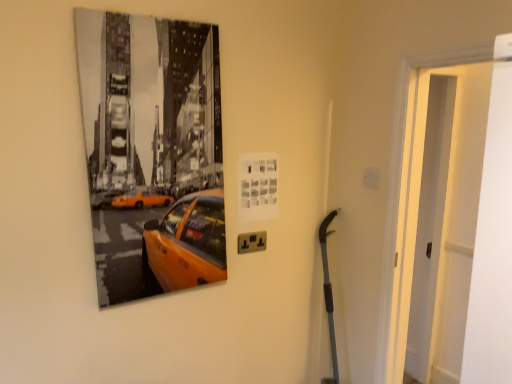
In order to face black plastic/socket at lower center, should I rotate leftwards or rightwards?

Turn left approximately 0.444 degrees to face it.

This screenshot has height=384, width=512. Describe the element at coordinates (252, 242) in the screenshot. I see `black plastic/socket at lower center` at that location.

At what (x,y) coordinates should I click in order to perform the action: click on black plastic/socket at lower center. Please return your answer as a coordinate pair (x, y). The image size is (512, 384). Looking at the image, I should click on point(252,242).

What is the approximate width of white matte door at right?

white matte door at right is 7.45 inches wide.

What do you see at coordinates (446, 216) in the screenshot? The height and width of the screenshot is (384, 512). I see `white matte door at right` at bounding box center [446, 216].

Identify the location of white matte door at right. This screenshot has width=512, height=384. (446, 216).

Measure the distance between point (478, 114) and camera.

7.09 feet.

In order to face white matte door at right, should I rotate leftwards or rightwards?

You should look right and rotate roughly 23.236 degrees.

What is the approximate height of white matte door at right?

white matte door at right is 1.55 meters tall.

I want to click on black plastic/socket at lower center, so click(252, 242).

Can you confirm if white matte door at right is positioned to the right of black plastic/socket at lower center?

Indeed, white matte door at right is positioned on the right side of black plastic/socket at lower center.

Who is more distant, white matte door at right or black plastic/socket at lower center?

Positioned behind is black plastic/socket at lower center.

Considering the positions of point (464, 168) and point (257, 235), is point (464, 168) closer or farther from the camera than point (257, 235)?

Point (464, 168) is farther from the camera than point (257, 235).

In the scene shown: From the image's perspective, who appears lower, white matte door at right or black plastic/socket at lower center?

black plastic/socket at lower center is shown below in the image.

From a real-world perspective, does white matte door at right stand above black plastic/socket at lower center?

Yes, from a real-world perspective, white matte door at right is on top of black plastic/socket at lower center.

Considering the sizes of objects white matte door at right and black plastic/socket at lower center in the image provided, who is wider, white matte door at right or black plastic/socket at lower center?

white matte door at right.

Between white matte door at right and black plastic/socket at lower center, which one has less height?

With less height is black plastic/socket at lower center.

Is white matte door at right bigger or smaller than black plastic/socket at lower center?

In the image, white matte door at right appears to be larger than black plastic/socket at lower center.

Would you say white matte door at right is inside or outside black plastic/socket at lower center?

white matte door at right is spatially situated outside black plastic/socket at lower center.

Would you say white matte door at right is a long distance from black plastic/socket at lower center?

Indeed, white matte door at right is not near black plastic/socket at lower center.

Is white matte door at right positioned with its back to black plastic/socket at lower center?

No, white matte door at right is not facing the opposite direction of black plastic/socket at lower center.

What's the angular difference between white matte door at right and black plastic/socket at lower center's facing directions?

white matte door at right and black plastic/socket at lower center are facing 91.9 degrees away from each other.

Measure the distance from white matte door at right to black plastic/socket at lower center.

The distance of white matte door at right from black plastic/socket at lower center is 1.25 meters.

There is a black plastic/socket at lower center. At what (x,y) coordinates should I click in order to perform the action: click on door above it (from a real-world perspective). Please return your answer as a coordinate pair (x, y). The width and height of the screenshot is (512, 384). Looking at the image, I should click on (446, 216).

Is black plastic/socket at lower center at the right side of white matte door at right?

Incorrect, black plastic/socket at lower center is not on the right side of white matte door at right.

Is black plastic/socket at lower center behind white matte door at right?

Yes, it is behind white matte door at right.

Considering the points (254, 251) and (438, 98), which point is behind, point (254, 251) or point (438, 98)?

The point (438, 98) is farther.

From the image's perspective, is black plastic/socket at lower center below white matte door at right?

Correct, black plastic/socket at lower center appears lower than white matte door at right in the image.

From a real-world perspective, which is physically below, black plastic/socket at lower center or white matte door at right?

black plastic/socket at lower center, from a real-world perspective.

In the scene shown: Considering the sizes of objects black plastic/socket at lower center and white matte door at right in the image provided, who is wider, black plastic/socket at lower center or white matte door at right?

white matte door at right is wider.

Between black plastic/socket at lower center and white matte door at right, which one has less height?

Standing shorter between the two is black plastic/socket at lower center.

Does black plastic/socket at lower center have a smaller size compared to white matte door at right?

Correct, black plastic/socket at lower center occupies less space than white matte door at right.

Consider the image. Is black plastic/socket at lower center outside of white matte door at right?

Absolutely, black plastic/socket at lower center is external to white matte door at right.

Are black plastic/socket at lower center and white matte door at right far apart?

Absolutely, black plastic/socket at lower center is distant from white matte door at right.

Is black plastic/socket at lower center positioned with its back to white matte door at right?

No, black plastic/socket at lower center is not facing the opposite direction of white matte door at right.

Can you tell me how much black plastic/socket at lower center and white matte door at right differ in facing direction?

The angle between the facing direction of black plastic/socket at lower center and the facing direction of white matte door at right is 91.9 degrees.

The height and width of the screenshot is (384, 512). In order to click on electric outlet lying on the left of white matte door at right in this screenshot , I will do `click(252, 242)`.

Locate an element on the screen. door that is above the black plastic/socket at lower center (from a real-world perspective) is located at coordinates (446, 216).

Find the location of a particular element. This screenshot has width=512, height=384. door in front of the black plastic/socket at lower center is located at coordinates (446, 216).